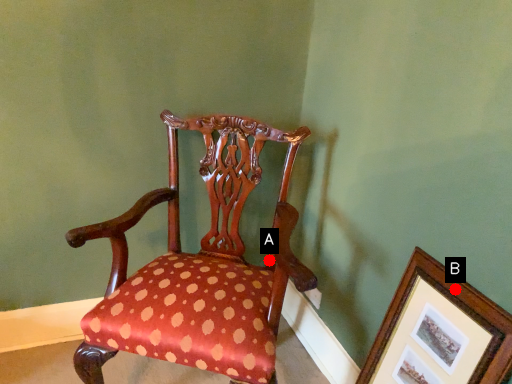
Question: Two points are circled on the image, labeled by A and B beside each circle. Which point is closer to the camera?

Choices:
 (A) A is closer
 (B) B is closer

Answer: (B)